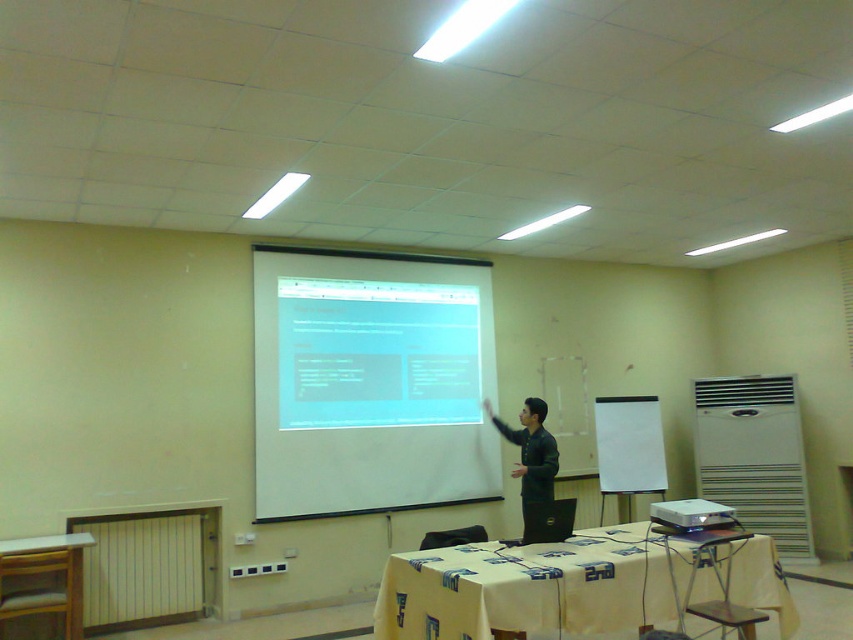
You are standing in the classroom and want to reach the point at coordinates point [26,608]. If your current position is 4 meters away from that point, how much further do you need to walk to reach it?

The distance of point [26,608] from viewer is 4.68 meters. Since you are currently 4 meters away, you need to walk an additional 0.68 meters to reach the point.

Looking at this image, you are a student sitting at the back of the classroom. The teacher is pointing to the white matte projection screen at center. If you want to see the screen clearly, should you move closer or stay where you are?

The white matte projection screen at center is 5.75 meters away from the viewer. Since you are sitting at the back, moving closer would allow you to see the screen more clearly.

You are organizing a small group discussion in the classroom and need to place a laptop and some papers on the wooden table at lower left. Considering the space available, will the green matte jacket at center interfere with accessing the table?

The wooden table at lower left occupies less space than the green matte jacket at center, so the jacket might block access to the table depending on its placement.